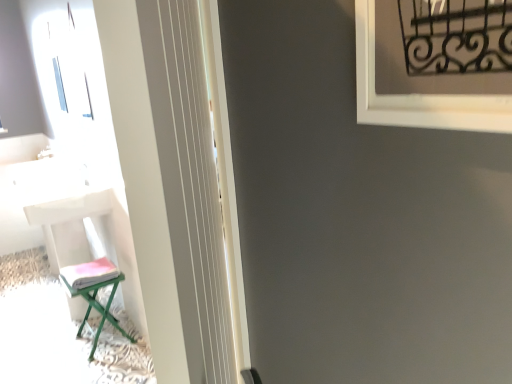
Question: Is white plastic chair at left, the 1th furniture in the left-to-right sequence, completely or partially outside of green metallic stool at lower left, the second furniture positioned from the left?

Choices:
 (A) yes
 (B) no

Answer: (A)

Question: Is green metallic stool at lower left, the second furniture positioned from the left, located within white plastic chair at left, the 1th furniture in the left-to-right sequence?

Choices:
 (A) yes
 (B) no

Answer: (B)

Question: Are white plastic chair at left, marked as the second furniture in a right-to-left arrangement, and green metallic stool at lower left, the second furniture positioned from the left, beside each other?

Choices:
 (A) no
 (B) yes

Answer: (A)

Question: Is white plastic chair at left, the 1th furniture in the left-to-right sequence, further to camera compared to green metallic stool at lower left, the second furniture positioned from the left?

Choices:
 (A) no
 (B) yes

Answer: (B)

Question: Does white plastic chair at left, the 1th furniture in the left-to-right sequence, have a greater height compared to green metallic stool at lower left, the second furniture positioned from the left?

Choices:
 (A) yes
 (B) no

Answer: (A)

Question: In terms of height, does white plastic chair at left, the 1th furniture in the left-to-right sequence, look taller or shorter compared to white glossy table at left?

Choices:
 (A) tall
 (B) short

Answer: (A)

Question: Considering their positions, is white plastic chair at left, the 1th furniture in the left-to-right sequence, located in front of or behind white glossy table at left?

Choices:
 (A) behind
 (B) front

Answer: (B)

Question: From a real-world perspective, is white plastic chair at left, the 1th furniture in the left-to-right sequence, above or below white glossy table at left?

Choices:
 (A) below
 (B) above

Answer: (A)

Question: Considering the positions of point (72, 294) and point (103, 236), is point (72, 294) closer or farther from the camera than point (103, 236)?

Choices:
 (A) farther
 (B) closer

Answer: (B)

Question: Do you think black wrought iron at upper right is within white glossy screen door at left, or outside of it?

Choices:
 (A) outside
 (B) inside

Answer: (A)

Question: Would you say black wrought iron at upper right is to the left or to the right of white glossy screen door at left in the picture?

Choices:
 (A) right
 (B) left

Answer: (A)

Question: Considering the positions of point (486, 104) and point (193, 82), is point (486, 104) closer or farther from the camera than point (193, 82)?

Choices:
 (A) farther
 (B) closer

Answer: (B)

Question: From a real-world perspective, is black wrought iron at upper right above or below white glossy screen door at left?

Choices:
 (A) above
 (B) below

Answer: (A)

Question: From a real-world perspective, is green metallic stool at lower left, the 1th furniture positioned from the right, physically located above or below white glossy table at left?

Choices:
 (A) below
 (B) above

Answer: (A)

Question: From the image's perspective, is green metallic stool at lower left, the second furniture positioned from the left, above or below white glossy table at left?

Choices:
 (A) above
 (B) below

Answer: (B)